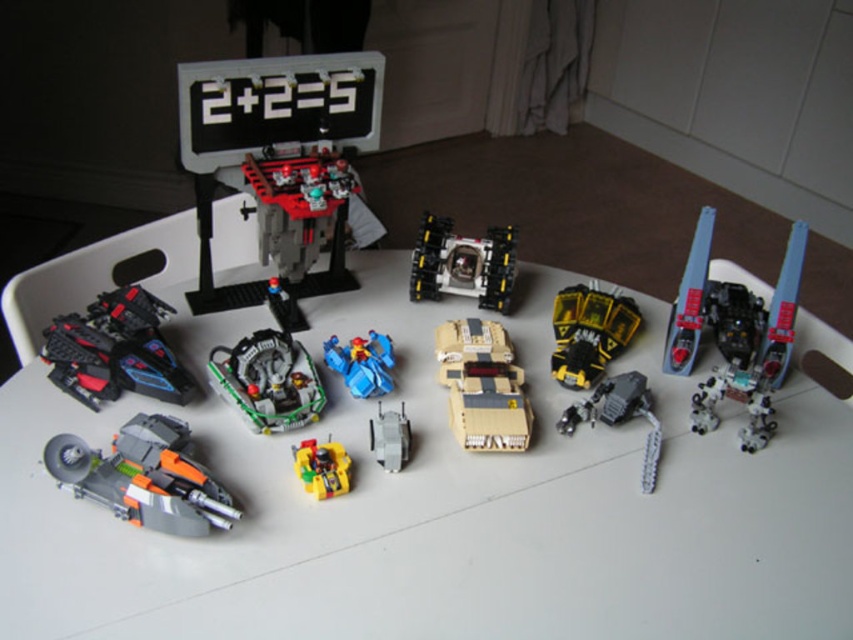
Is blue plastic motorcycle at center below yellow matte/soft plastic toy at center?

Actually, blue plastic motorcycle at center is above yellow matte/soft plastic toy at center.

Does blue plastic motorcycle at center have a larger size compared to yellow matte/soft plastic toy at center?

Yes.

Is point (387, 353) positioned before point (323, 474)?

No, (387, 353) is further to viewer.

Locate an element on the screen. blue plastic motorcycle at center is located at coordinates (363, 364).

The width and height of the screenshot is (853, 640). Describe the element at coordinates (302, 216) in the screenshot. I see `matte black vehicle at center` at that location.

Is point (343, 177) more distant than point (328, 490)?

Yes.

I want to click on matte black vehicle at center, so click(302, 216).

Between shiny black spaceship at left and yellow matte truck at center, which one has more height?

shiny black spaceship at left is taller.

Who is more distant from viewer, (94,388) or (584,321)?

The point (584,321) is behind.

Where is `shiny black spaceship at left`? shiny black spaceship at left is located at coordinates 115,349.